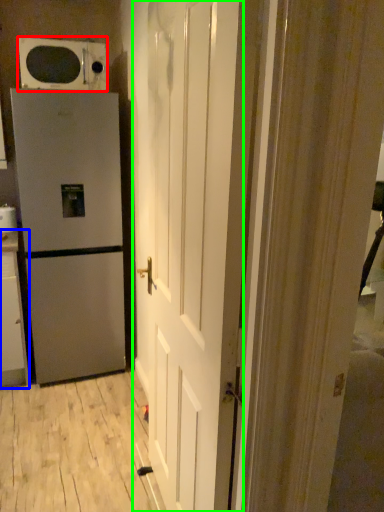
Question: Based on their relative distances, which object is farther from microwave oven (highlighted by a red box)? Choose from cabinetry (highlighted by a blue box) and door (highlighted by a green box).

Choices:
 (A) cabinetry
 (B) door

Answer: (B)